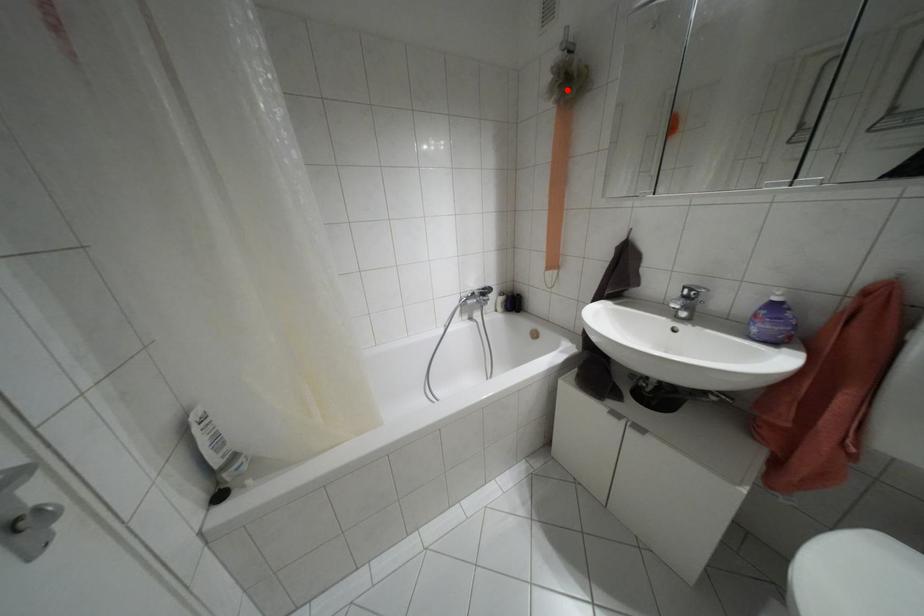
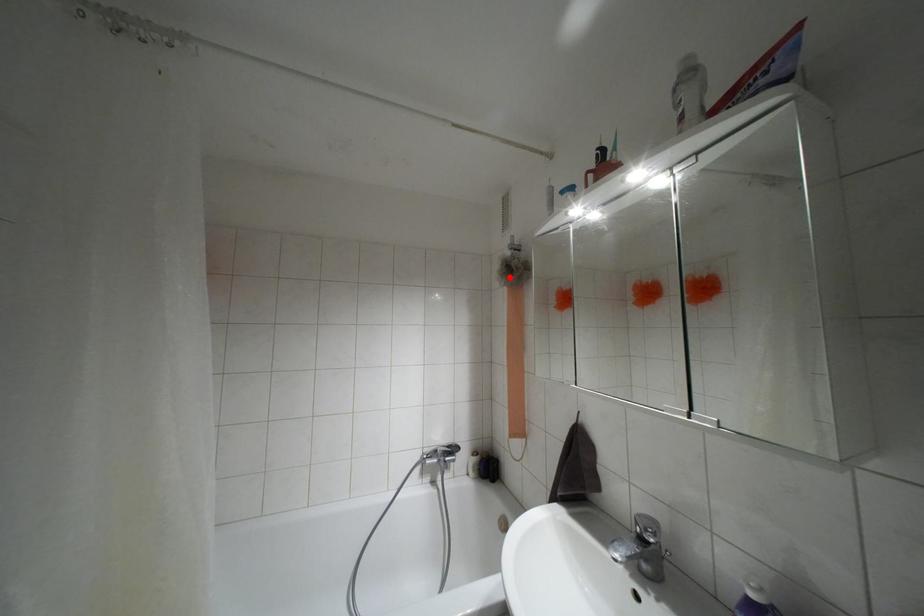
I am providing you with two images of the same scene from different viewpoints. A red point is marked on the first image and another point is marked on the second image. Is the marked point in image1 the same physical position as the marked point in image2?

Yes